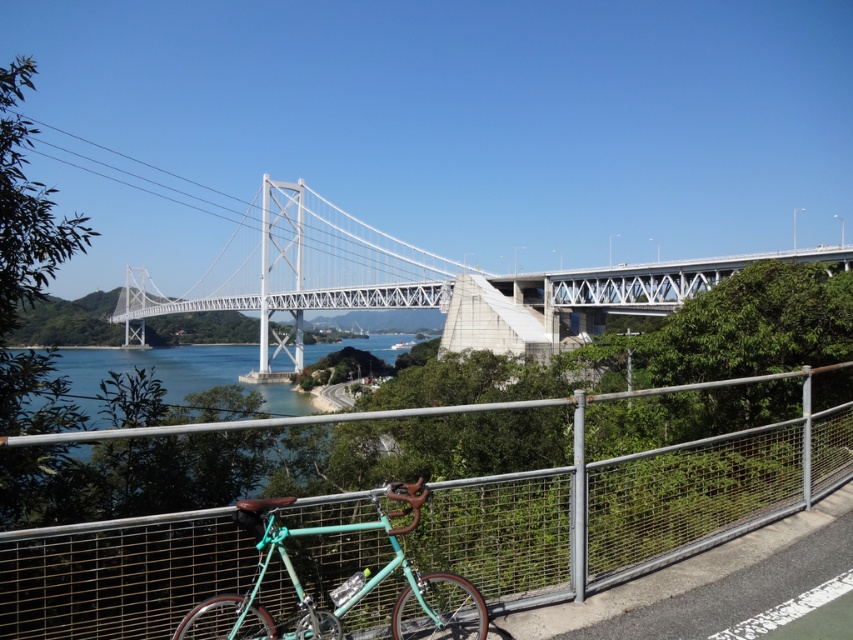
Which of these two, metal mesh fence at lower center or white metallic suspension bridge at center, stands taller?

Standing taller between the two is white metallic suspension bridge at center.

Is metal mesh fence at lower center further to the viewer compared to white metallic suspension bridge at center?

No, it is not.

The width and height of the screenshot is (853, 640). Describe the element at coordinates (625, 508) in the screenshot. I see `metal mesh fence at lower center` at that location.

You are a GUI agent. You are given a task and a screenshot of the screen. Output one action in this format:
    pyautogui.click(x=<x>, y=<y>)
    Task: Click on the metal mesh fence at lower center
    The width and height of the screenshot is (853, 640).
    Given the screenshot: What is the action you would take?
    pyautogui.click(x=625, y=508)

Is white metallic suspension bridge at center further to camera compared to teal matte bicycle at center?

That is True.

Is point (112, 321) closer to camera compared to point (329, 611)?

No, (112, 321) is further to viewer.

At what (x,y) coordinates should I click in order to perform the action: click on white metallic suspension bridge at center. Please return your answer as a coordinate pair (x, y). This screenshot has width=853, height=640. Looking at the image, I should click on tap(444, 289).

Based on the photo, can you confirm if metal mesh fence at lower center is bigger than teal matte bicycle at center?

Incorrect, metal mesh fence at lower center is not larger than teal matte bicycle at center.

Is metal mesh fence at lower center closer to the viewer compared to teal matte bicycle at center?

That is False.

What are the coordinates of `metal mesh fence at lower center` in the screenshot? It's located at (625, 508).